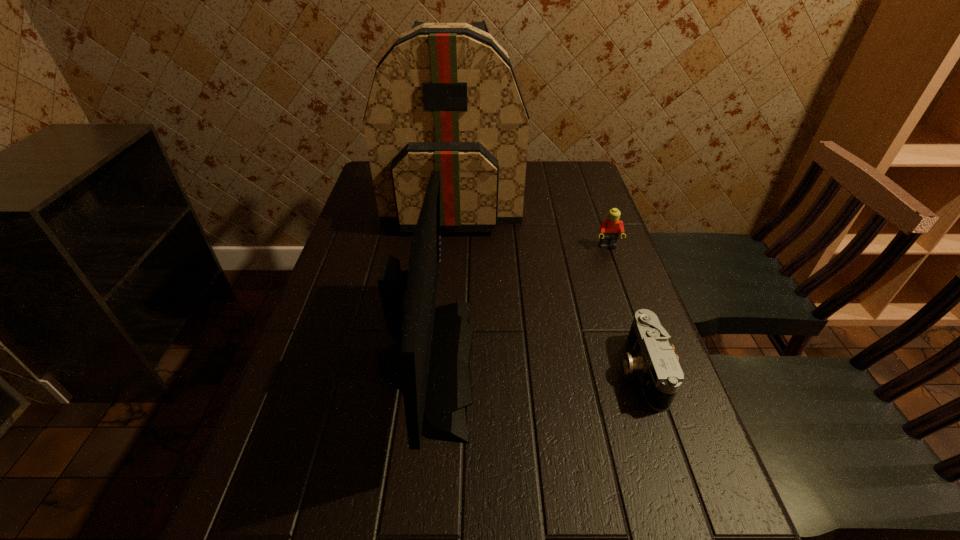
Image resolution: width=960 pixels, height=540 pixels. I want to click on object that is the second closest to the shortest object, so click(x=610, y=228).

Identify which object is the nearest to the tallest object. Please provide its 2D coordinates. Your answer should be formatted as a tuple, i.e. [(x, y)], where the tuple contains the x and y coordinates of a point satisfying the conditions above.

[(610, 228)]

Where is `vacant region that satisfies the following two spatial constraints: 1. on the face of the Lego; 2. on the lens of the camera`? vacant region that satisfies the following two spatial constraints: 1. on the face of the Lego; 2. on the lens of the camera is located at coordinates click(x=653, y=370).

The width and height of the screenshot is (960, 540). I want to click on free space that satisfies the following two spatial constraints: 1. on the face of the third nearest object; 2. on the lens of the shortest object, so click(653, 370).

This screenshot has width=960, height=540. Identify the location of vacant space that satisfies the following two spatial constraints: 1. on the front face of the farthest object; 2. on the screen side of the third shortest object. (439, 363).

This screenshot has width=960, height=540. In order to click on vacant space that satisfies the following two spatial constraints: 1. on the front face of the backpack; 2. on the screen side of the third shortest object in this screenshot , I will do `click(439, 363)`.

Identify the location of vacant point that satisfies the following two spatial constraints: 1. on the front face of the farthest object; 2. on the screen side of the monitor. This screenshot has height=540, width=960. (439, 363).

Find the location of a particular element. The height and width of the screenshot is (540, 960). free region that satisfies the following two spatial constraints: 1. on the face of the second shortest object; 2. on the lens of the shortest object is located at coordinates (653, 370).

Find the location of a particular element. vacant area in the image that satisfies the following two spatial constraints: 1. on the face of the Lego; 2. on the lens of the camera is located at coordinates (653, 370).